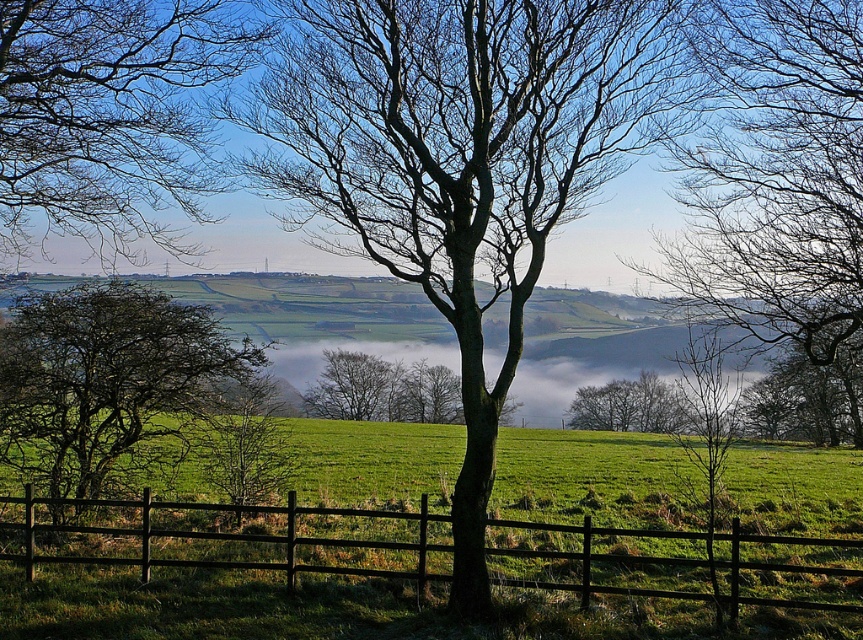
Question: Which point is closer to the camera taking this photo?

Choices:
 (A) (357, 396)
 (B) (394, 22)
 (C) (681, 241)

Answer: (B)

Question: In this image, where is bare branches at center located relative to brown wooden fence at center?

Choices:
 (A) left
 (B) right

Answer: (B)

Question: Is bare branches at center above green leafy tree at left?

Choices:
 (A) no
 (B) yes

Answer: (B)

Question: Is green bark tree at center to the left of green leafy tree at left from the viewer's perspective?

Choices:
 (A) no
 (B) yes

Answer: (A)

Question: Which point is closer to the camera?

Choices:
 (A) smooth gray tree at center
 (B) green leafy tree at left
 (C) brown wooden fence at center
 (D) bare branches at center

Answer: (C)

Question: Which of the following is the farthest from the observer?

Choices:
 (A) (606, 170)
 (B) (186, 512)

Answer: (B)